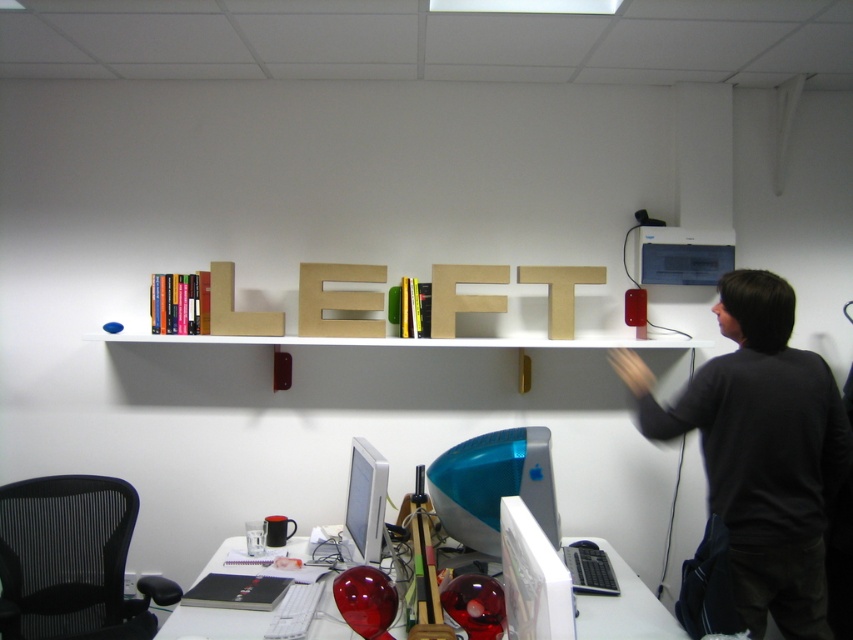
Question: Does dark gray sweater at upper right appear on the left side of black mesh swivel chair at left?

Choices:
 (A) yes
 (B) no

Answer: (B)

Question: Is black mesh swivel chair at left smaller than white glossy computer desk at lower center?

Choices:
 (A) yes
 (B) no

Answer: (B)

Question: Which point is farther to the camera?

Choices:
 (A) (70, 593)
 (B) (178, 621)
 (C) (804, 570)

Answer: (A)

Question: Does black mesh swivel chair at left have a smaller size compared to white glossy computer desk at lower center?

Choices:
 (A) yes
 (B) no

Answer: (B)

Question: Which of the following is the closest to the observer?

Choices:
 (A) tap(583, 609)
 (B) tap(93, 486)

Answer: (A)

Question: Which of the following is the closest to the observer?

Choices:
 (A) black mesh swivel chair at left
 (B) white glossy computer desk at lower center
 (C) dark gray sweater at upper right

Answer: (B)